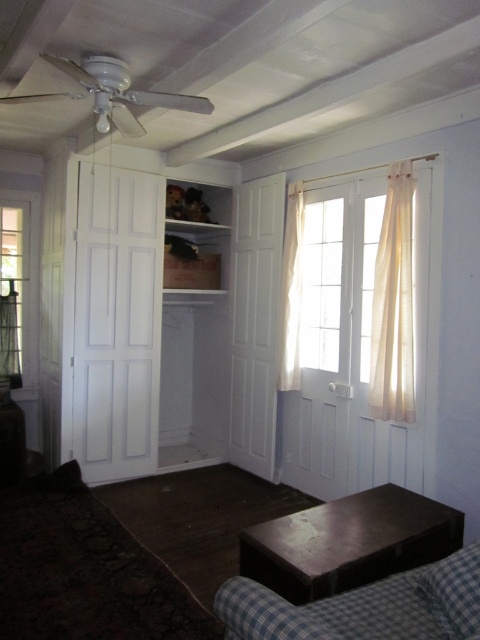
Which is more to the left, checkered fabric couch at lower right or ivory sheer curtain at right?

Positioned to the left is checkered fabric couch at lower right.

The width and height of the screenshot is (480, 640). Identify the location of checkered fabric couch at lower right. (363, 605).

Identify the location of checkered fabric couch at lower right. Image resolution: width=480 pixels, height=640 pixels. (363, 605).

At what (x,y) coordinates should I click in order to perform the action: click on checkered fabric couch at lower right. Please return your answer as a coordinate pair (x, y). The width and height of the screenshot is (480, 640). Looking at the image, I should click on (363, 605).

Is point (344, 588) in front of point (248, 593)?

No.

Is shiny dark wood coffee table at lower right to the right of checkered fabric couch at lower right from the viewer's perspective?

Indeed, shiny dark wood coffee table at lower right is positioned on the right side of checkered fabric couch at lower right.

Is point (452, 548) farther from camera compared to point (385, 586)?

Yes, point (452, 548) is behind point (385, 586).

Find the location of `shiny dark wood coffee table at lower right`. shiny dark wood coffee table at lower right is located at coordinates (348, 541).

Can you confirm if shiny dark wood coffee table at lower right is taller than ivory sheer curtain at right?

In fact, shiny dark wood coffee table at lower right may be shorter than ivory sheer curtain at right.

Can you confirm if shiny dark wood coffee table at lower right is thinner than ivory sheer curtain at right?

In fact, shiny dark wood coffee table at lower right might be wider than ivory sheer curtain at right.

Measure the distance between point [358,499] and camera.

Point [358,499] and camera are 2.69 meters apart.

The height and width of the screenshot is (640, 480). In order to click on shiny dark wood coffee table at lower right in this screenshot , I will do `click(348, 541)`.